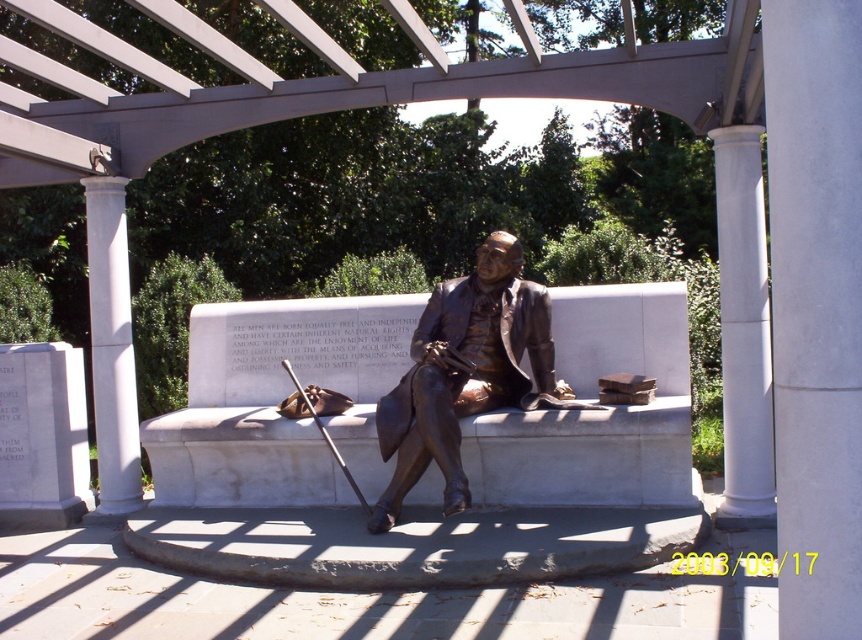
Can you confirm if bronze statue at center is shorter than white marble column at left?

Correct, bronze statue at center is not as tall as white marble column at left.

Is bronze statue at center to the left of white marble column at left from the viewer's perspective?

In fact, bronze statue at center is to the right of white marble column at left.

Is point (450, 493) less distant than point (116, 396)?

Yes, it is in front of point (116, 396).

This screenshot has width=862, height=640. Identify the location of bronze statue at center. (464, 372).

Between point (756, 406) and point (117, 250), which one is positioned behind?

Positioned behind is point (117, 250).

Is white marble column at right bigger than white marble column at left?

Indeed, white marble column at right has a larger size compared to white marble column at left.

Is point (721, 269) in front of point (102, 216)?

Yes, point (721, 269) is in front of point (102, 216).

The height and width of the screenshot is (640, 862). Find the location of `white marble column at right`. white marble column at right is located at coordinates (742, 330).

Between point (475, 412) and point (756, 252), which one is positioned in front?

Point (756, 252) is in front.

Which is more to the right, bronze statue at center or white marble column at right?

Positioned to the right is white marble column at right.

Is point (497, 344) positioned behind point (761, 432)?

That is True.

Where is `bronze statue at center`? The width and height of the screenshot is (862, 640). bronze statue at center is located at coordinates (464, 372).